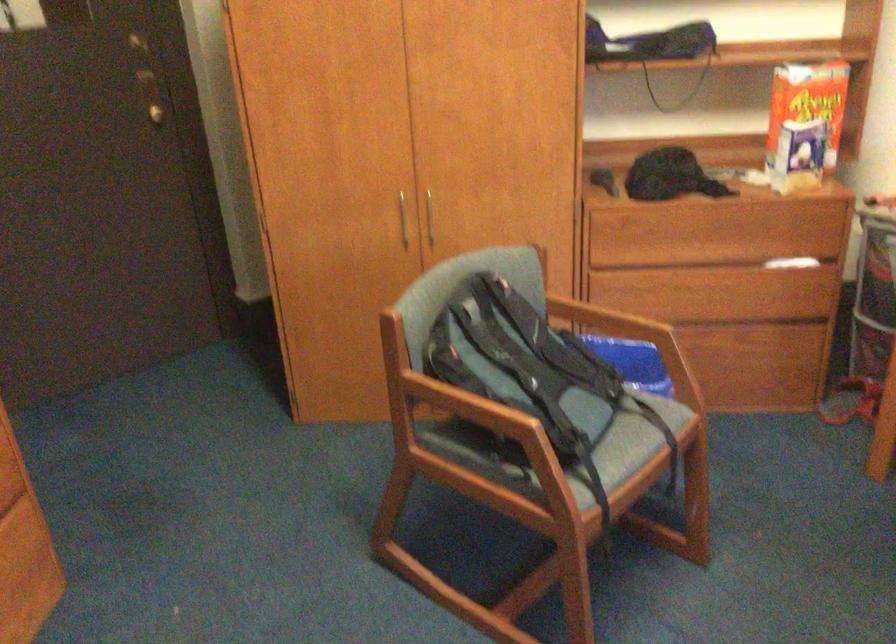
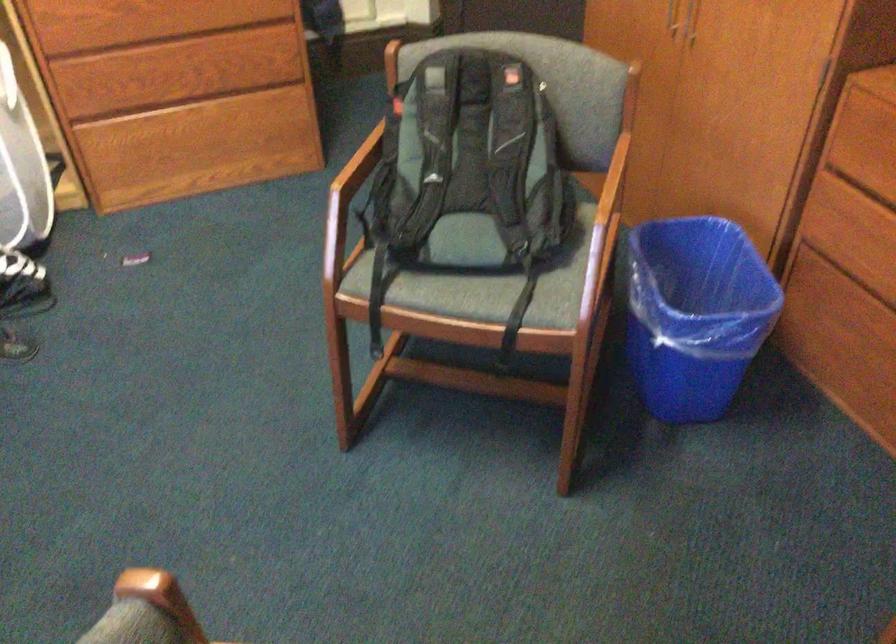
In the second image, find the point that corresponds to (631,319) in the first image.

(609, 201)